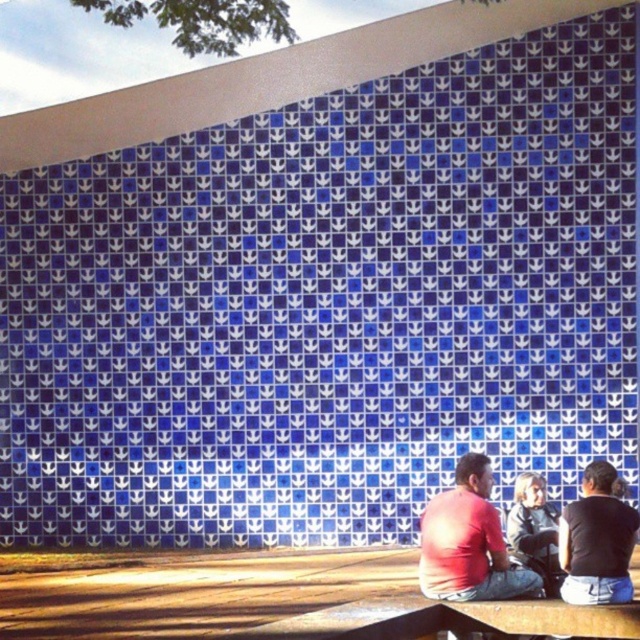
Question: Can you confirm if matte red shirt at lower center is positioned to the left of black matte shirt at lower right?

Choices:
 (A) no
 (B) yes

Answer: (B)

Question: Can you confirm if matte red shirt at lower center is thinner than black matte shirt at lower right?

Choices:
 (A) yes
 (B) no

Answer: (B)

Question: Which object appears closest to the camera in this image?

Choices:
 (A) black matte shirt at lower right
 (B) matte red shirt at lower center

Answer: (A)

Question: Does matte red shirt at lower center have a smaller size compared to black matte shirt at lower right?

Choices:
 (A) no
 (B) yes

Answer: (A)

Question: Which point is farther from the camera taking this photo?

Choices:
 (A) (477, 547)
 (B) (566, 566)

Answer: (B)